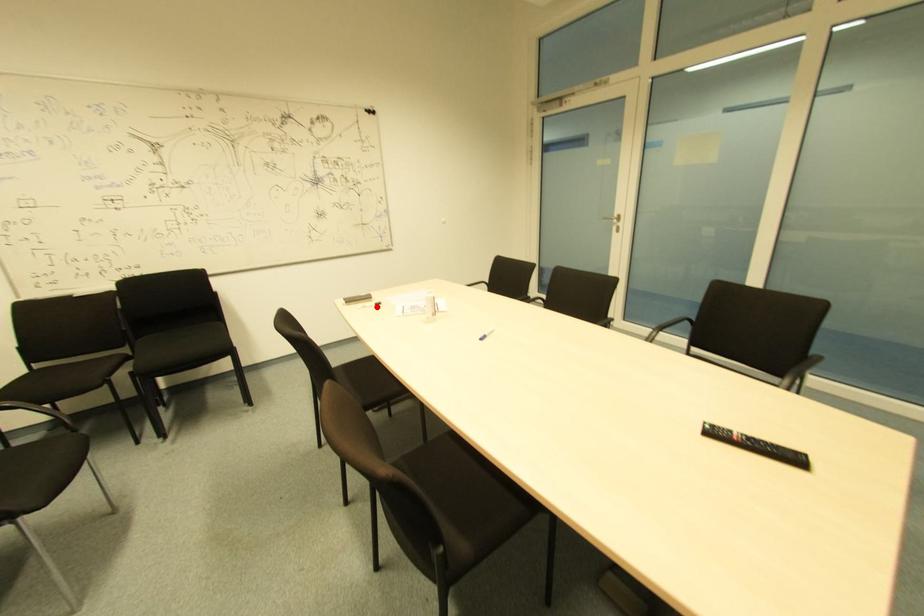
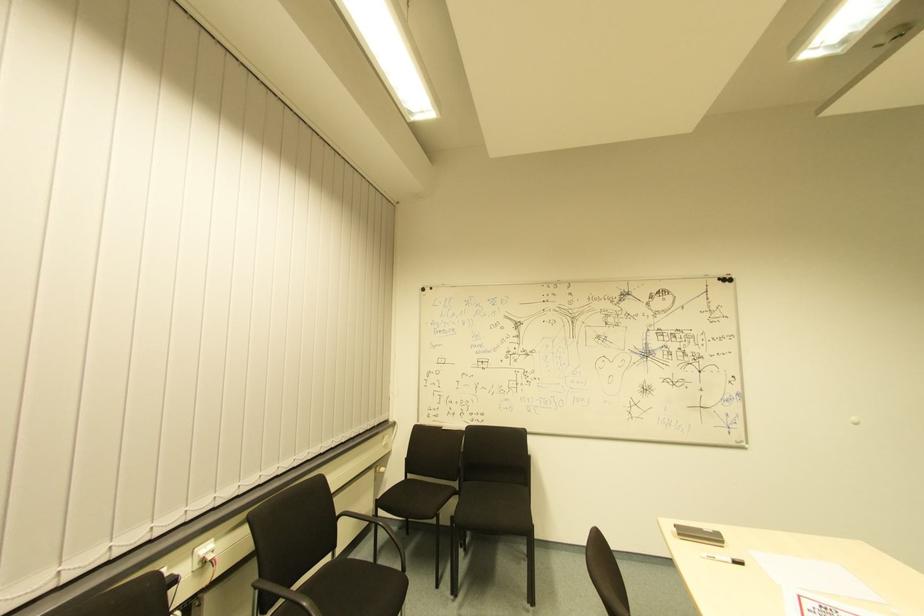
The point at the highlighted location is marked in the first image. Where is the corresponding point in the second image?

(737, 565)